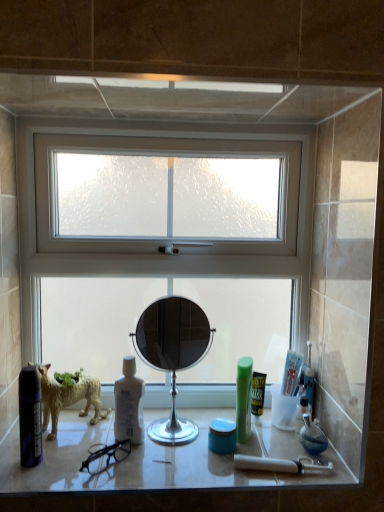
Locate an element on the screen. The image size is (384, 512). free space to the back side of matte black can at left is located at coordinates pos(68,438).